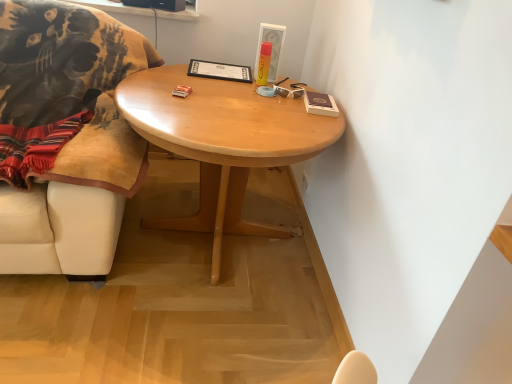
Where is `vacant point above light wood/finish coffee table at center (from a real-world perspective)`? The height and width of the screenshot is (384, 512). vacant point above light wood/finish coffee table at center (from a real-world perspective) is located at coordinates (x=228, y=100).